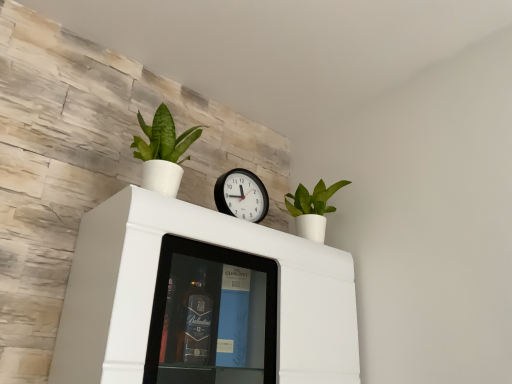
Question: Considering the relative sizes of white matte cabinet at upper center and green matte plant at upper right, arranged as the 2th houseplant when viewed from the front, in the image provided, is white matte cabinet at upper center smaller than green matte plant at upper right, arranged as the 2th houseplant when viewed from the front,?

Choices:
 (A) yes
 (B) no

Answer: (B)

Question: Is the depth of white matte cabinet at upper center greater than that of green matte plant at upper right, positioned as the 1th houseplant in right-to-left order?

Choices:
 (A) yes
 (B) no

Answer: (B)

Question: Can you confirm if white matte cabinet at upper center is positioned to the right of green matte plant at upper right, marked as the second houseplant in a left-to-right arrangement?

Choices:
 (A) no
 (B) yes

Answer: (A)

Question: Does white matte cabinet at upper center appear on the left side of green matte plant at upper right, marked as the second houseplant in a left-to-right arrangement?

Choices:
 (A) yes
 (B) no

Answer: (A)

Question: Is white matte cabinet at upper center positioned far away from green matte plant at upper right, marked as the second houseplant in a left-to-right arrangement?

Choices:
 (A) no
 (B) yes

Answer: (A)

Question: Is white matte cabinet at upper center positioned before green matte plant at upper right, marked as the second houseplant in a left-to-right arrangement?

Choices:
 (A) yes
 (B) no

Answer: (A)

Question: Is the depth of black plastic wall clock at center greater than that of green matte plant at upper right, marked as the second houseplant in a left-to-right arrangement?

Choices:
 (A) no
 (B) yes

Answer: (A)

Question: Is black plastic wall clock at center turned away from green matte plant at upper right, positioned as the 1th houseplant in right-to-left order?

Choices:
 (A) no
 (B) yes

Answer: (A)

Question: Is black plastic wall clock at center aimed at green matte plant at upper right, arranged as the 2th houseplant when viewed from the front?

Choices:
 (A) no
 (B) yes

Answer: (A)

Question: Is black plastic wall clock at center thinner than green matte plant at upper right, marked as the second houseplant in a left-to-right arrangement?

Choices:
 (A) yes
 (B) no

Answer: (A)

Question: Considering the relative sizes of black plastic wall clock at center and green matte plant at upper right, the first houseplant in the back-to-front sequence, in the image provided, is black plastic wall clock at center taller than green matte plant at upper right, the first houseplant in the back-to-front sequence,?

Choices:
 (A) yes
 (B) no

Answer: (B)

Question: Is black plastic wall clock at center at the right side of green matte plant at upper right, marked as the second houseplant in a left-to-right arrangement?

Choices:
 (A) no
 (B) yes

Answer: (A)

Question: Can you confirm if green matte plant at upper right, arranged as the 2th houseplant when viewed from the front, is positioned to the left of white matte cabinet at upper center?

Choices:
 (A) yes
 (B) no

Answer: (B)